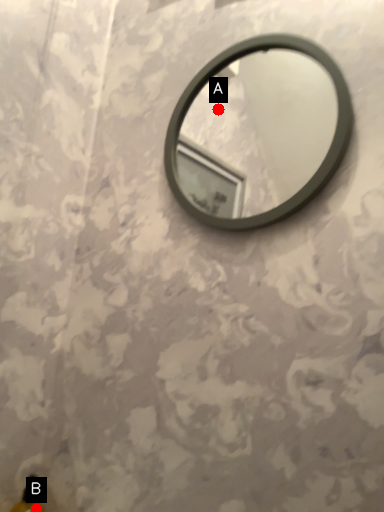
Question: Two points are circled on the image, labeled by A and B beside each circle. Which point is further to the camera?

Choices:
 (A) A is further
 (B) B is further

Answer: (A)